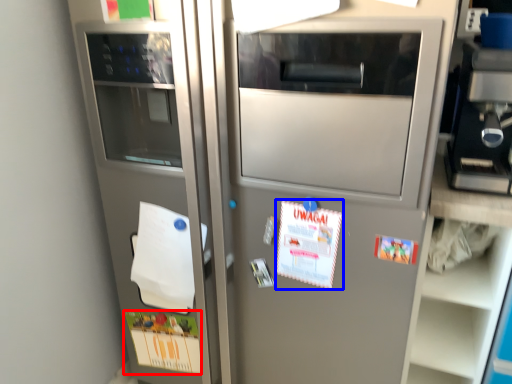
Question: Which point is further to the camera, postcard (highlighted by a red box) or postcard (highlighted by a blue box)?

Choices:
 (A) postcard
 (B) postcard

Answer: (A)